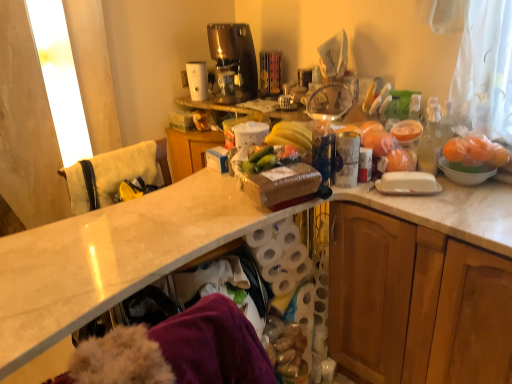
In order to face white plastic coffee maker at upper center, the second appliance when ordered from bottom to top, should I rotate leftwards or rightwards?

A 7.826 degree turn to the left will do.

What is the approximate height of green matte cucumber at center?

It is 4.75 centimeters.

Image resolution: width=512 pixels, height=384 pixels. What do you see at coordinates (415, 303) in the screenshot?
I see `wooden cabinet at right` at bounding box center [415, 303].

What do you see at coordinates (184, 225) in the screenshot? I see `white marble countertop at center` at bounding box center [184, 225].

At what (x,y) coordinates should I click in order to perform the action: click on transparent glass bowl at upper center, the 1th appliance viewed from the front. Please return your answer as a coordinate pair (x, y). Looking at the image, I should click on (329, 102).

Is clear plastic bottle at right next to green matte cucumber at center and touching it?

No, clear plastic bottle at right is not touching green matte cucumber at center.

Does point (424, 129) come in front of point (270, 166)?

That is False.

Considering the relative sizes of clear plastic bottle at right and green matte cucumber at center in the image provided, is clear plastic bottle at right bigger than green matte cucumber at center?

Indeed, clear plastic bottle at right has a larger size compared to green matte cucumber at center.

Is green matte cucumber at center at the back of clear plastic bottle at right?

clear plastic bottle at right is not turned away from green matte cucumber at center.

Is white marble countertop at center located within white glossy mixing bowl at right?

No, white marble countertop at center is not a part of white glossy mixing bowl at right.

From a real-world perspective, is white glossy mixing bowl at right physically above white marble countertop at center?

Indeed, from a real-world perspective, white glossy mixing bowl at right stands above white marble countertop at center.

From the image's perspective, does white glossy mixing bowl at right appear higher than white marble countertop at center?

Yes.

In the scene shown: Is white towel at left to the left of white glossy mixing bowl at right from the viewer's perspective?

Correct, you'll find white towel at left to the left of white glossy mixing bowl at right.

This screenshot has height=384, width=512. In order to click on leftover that is under the white glossy mixing bowl at right (from a real-world perspective) in this screenshot , I will do `click(114, 174)`.

From a real-world perspective, is white towel at left located beneath white glossy mixing bowl at right?

Yes, from a real-world perspective, white towel at left is below white glossy mixing bowl at right.

Is white towel at left in contact with white glossy mixing bowl at right?

white towel at left and white glossy mixing bowl at right are not in contact.

Could you tell me if white plastic coffee maker at upper center, which is counted as the second appliance, starting from the right, is facing transparent glass bowl at upper center, arranged as the 2th appliance when viewed from the top?

No, white plastic coffee maker at upper center, which is counted as the second appliance, starting from the right, does not turn towards transparent glass bowl at upper center, arranged as the 2th appliance when viewed from the top.

From the image's perspective, is white plastic coffee maker at upper center, placed as the second appliance when sorted from front to back, located above or below transparent glass bowl at upper center, arranged as the 2th appliance when viewed from the top?

white plastic coffee maker at upper center, placed as the second appliance when sorted from front to back, is above transparent glass bowl at upper center, arranged as the 2th appliance when viewed from the top.

Is white plastic coffee maker at upper center, the second appliance when ordered from bottom to top, far away from transparent glass bowl at upper center, which appears as the second appliance when viewed from the left?

Actually, white plastic coffee maker at upper center, the second appliance when ordered from bottom to top, and transparent glass bowl at upper center, which appears as the second appliance when viewed from the left, are a little close together.

Between white plastic coffee maker at upper center, marked as the first appliance in a back-to-front arrangement, and transparent glass bowl at upper center, the 2th appliance when ordered from back to front, which one has less height?

→ transparent glass bowl at upper center, the 2th appliance when ordered from back to front, is shorter.

Does point (278, 155) come farther from viewer compared to point (194, 79)?

No, it is not.

Is green matte cucumber at center thinner than white plastic coffee maker at upper center, which ranks as the first appliance in left-to-right order?

Yes, green matte cucumber at center is thinner than white plastic coffee maker at upper center, which ranks as the first appliance in left-to-right order.

Can you tell me how much green matte cucumber at center and white plastic coffee maker at upper center, placed as the second appliance when sorted from front to back, differ in facing direction?

There is a 0.0514-degree angle between the facing directions of green matte cucumber at center and white plastic coffee maker at upper center, placed as the second appliance when sorted from front to back.

Is green matte cucumber at center not near white plastic coffee maker at upper center, which is counted as the second appliance, starting from the right?

No, green matte cucumber at center is in close proximity to white plastic coffee maker at upper center, which is counted as the second appliance, starting from the right.

Could you tell me if white marble countertop at center is facing transparent glass bowl at upper center, which appears as the second appliance when viewed from the left?

No, white marble countertop at center is not turned towards transparent glass bowl at upper center, which appears as the second appliance when viewed from the left.

From the image's perspective, which is above, white marble countertop at center or transparent glass bowl at upper center, the 1th appliance viewed from the front?

transparent glass bowl at upper center, the 1th appliance viewed from the front.

You are a GUI agent. You are given a task and a screenshot of the screen. Output one action in this format:
    pyautogui.click(x=<x>, y=<y>)
    Task: Click on the countertop below the transparent glass bowl at upper center, which appears as the second appliance when viewed from the left (from the image's perspective)
    
    Given the screenshot: What is the action you would take?
    pyautogui.click(x=184, y=225)

Could you tell me if white marble countertop at center is facing orange matte fruit at right?

No, white marble countertop at center is not facing towards orange matte fruit at right.

From a real-world perspective, who is located higher, white marble countertop at center or orange matte fruit at right?

orange matte fruit at right.

In terms of size, does white marble countertop at center appear bigger or smaller than orange matte fruit at right?

In the image, white marble countertop at center appears to be larger than orange matte fruit at right.

Which is in front, point (463, 226) or point (477, 144)?

The point (463, 226) is closer to the camera.

This screenshot has height=384, width=512. There is a clear plastic bottle at right. Find the location of `food above it (from a real-world perspective)`. food above it (from a real-world perspective) is located at coordinates (269, 158).

This screenshot has width=512, height=384. What are the coordinates of `mixing bowl on the right of the white marble countertop at center` in the screenshot? It's located at (464, 174).

Based on their spatial positions, is white glossy mixing bowl at right or white towel at left closer to white marble countertop at center?

white towel at left.

From the picture: Based on their spatial positions, is wooden cabinet at right or orange matte fruit at right further from clear plastic bottle at right?

Based on the image, wooden cabinet at right appears to be further to clear plastic bottle at right.

Estimate the real-world distances between objects in this image. Which object is further from orange matte fruit at right, clear plastic bottle at right or white towel at left?

white towel at left.

Which object lies further to the anchor point wooden cabinet at right, white glossy mixing bowl at right or green matte cucumber at center?

green matte cucumber at center lies further to wooden cabinet at right than the other object.

From the image, which object appears to be farther from transparent glass bowl at upper center, which ranks as the first appliance in right-to-left order, orange matte fruit at right or white plastic coffee maker at upper center, marked as the first appliance in a back-to-front arrangement?

white plastic coffee maker at upper center, marked as the first appliance in a back-to-front arrangement.

Considering their positions, is green matte cucumber at center positioned closer to clear plastic bottle at right than white plastic coffee maker at upper center, which ranks as the first appliance in left-to-right order?

green matte cucumber at center is positioned closer to the anchor clear plastic bottle at right.

Estimate the real-world distances between objects in this image. Which object is further from white marble countertop at center, white towel at left or white glossy mixing bowl at right?

white glossy mixing bowl at right is further to white marble countertop at center.

Based on their spatial positions, is white marble countertop at center or white glossy mixing bowl at right closer to white towel at left?

white marble countertop at center lies closer to white towel at left than the other object.

Find the location of `bottle between white marble countertop at center and transparent glass bowl at upper center, arranged as the 2th appliance when viewed from the top, along the z-axis`. bottle between white marble countertop at center and transparent glass bowl at upper center, arranged as the 2th appliance when viewed from the top, along the z-axis is located at coordinates (430, 139).

In order to click on cabinetry between white towel at left and orange matte fruit at right in this screenshot , I will do `click(415, 303)`.

The width and height of the screenshot is (512, 384). In order to click on cabinetry between white plastic coffee maker at upper center, which appears as the first appliance when viewed from the top, and white glossy mixing bowl at right in this screenshot , I will do point(415,303).

Find the location of a particular element. This screenshot has width=512, height=384. food between white plastic coffee maker at upper center, which appears as the first appliance when viewed from the top, and clear plastic bottle at right, in the horizontal direction is located at coordinates (269, 158).